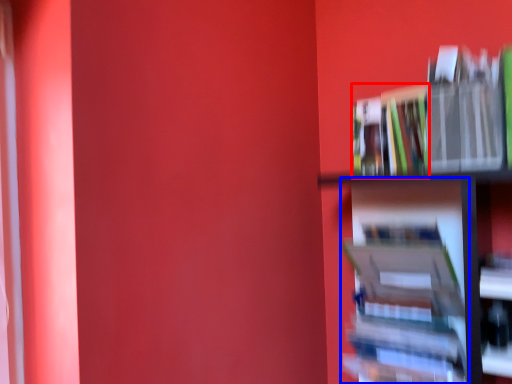
Question: Among these objects, which one is farthest to the camera, book (highlighted by a red box) or book (highlighted by a blue box)?

Choices:
 (A) book
 (B) book

Answer: (A)